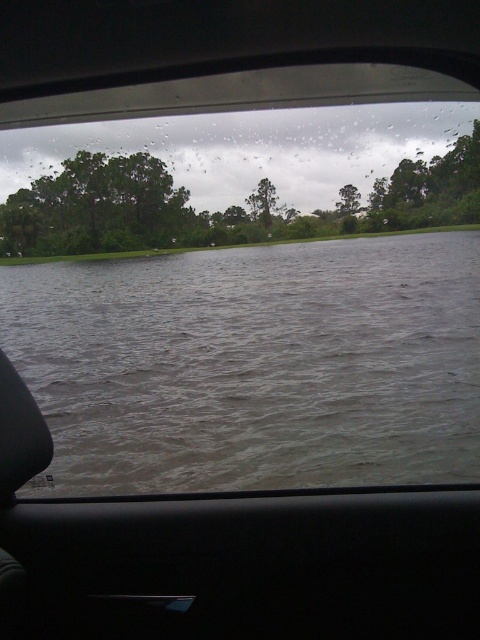
You are a passenger in the car and notice the gray water at center and the green leafy tree at center outside the rear window. Which object takes up more space in the window view?

The gray water at center takes up more space in the window view because it is larger in size than the green leafy tree at center.

You are inside a car and looking out the rear window. You notice a point marked at coordinates (253, 364). Based on the scene description, what is located at that point?

The point at coordinates (253, 364) indicates gray water at center.